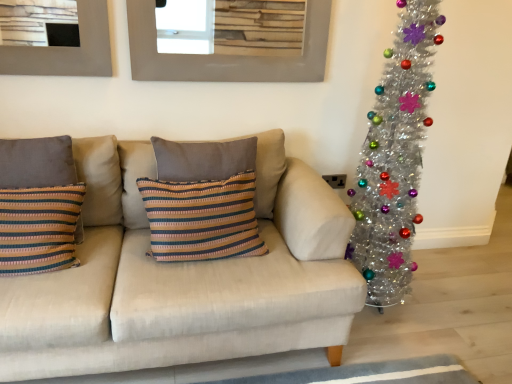
This screenshot has height=384, width=512. I want to click on vacant space in matte gray picture frame at upper center (from a real-world perspective), so pyautogui.click(x=221, y=115).